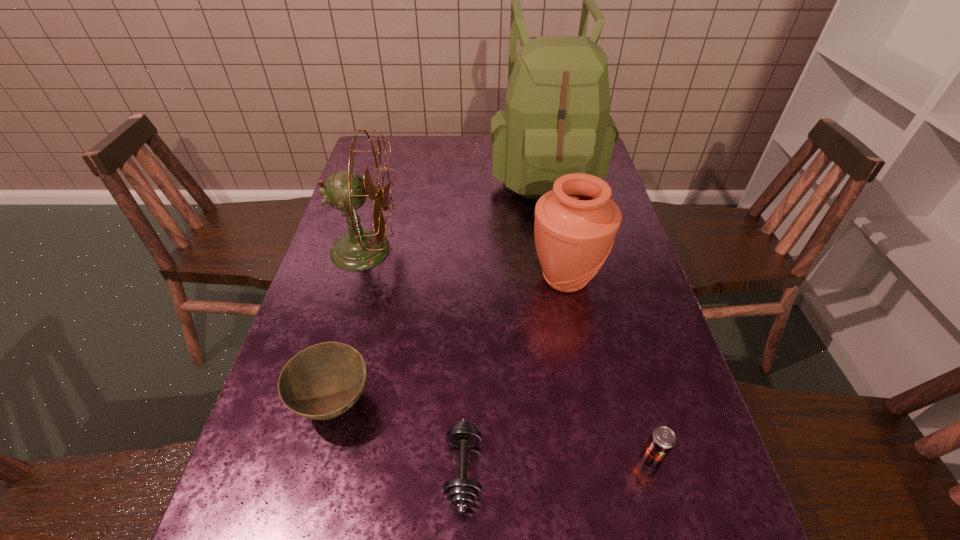
This screenshot has height=540, width=960. I want to click on backpack, so click(x=556, y=121).

The image size is (960, 540). Identify the location of the tallest object. (556, 121).

Where is `fan`? The width and height of the screenshot is (960, 540). fan is located at coordinates click(x=359, y=249).

You are a GUI agent. You are given a task and a screenshot of the screen. Output one action in this format:
    pyautogui.click(x=<x>, y=<y>)
    Task: Click on the vase
    
    Given the screenshot: What is the action you would take?
    pyautogui.click(x=575, y=225)

The image size is (960, 540). I want to click on bowl, so click(321, 382).

You are a GUI agent. You are given a task and a screenshot of the screen. Output one action in this format:
    pyautogui.click(x=<x>, y=<y>)
    Task: Click on the beer can
    This screenshot has width=960, height=540.
    Given the screenshot: What is the action you would take?
    pyautogui.click(x=662, y=440)

The image size is (960, 540). Find the location of `the shortest object`. the shortest object is located at coordinates (461, 493).

At what (x,y) coordinates should I click in order to perform the action: click on the fourth object from right to left. Please return your answer as a coordinate pair (x, y). This screenshot has height=540, width=960. Looking at the image, I should click on (461, 493).

You are a GUI agent. You are given a task and a screenshot of the screen. Output one action in this format:
    pyautogui.click(x=<x>, y=<y>)
    Task: Click on the free space located 0.400m on the front pocket of the farthest object
    
    Given the screenshot: What is the action you would take?
    pyautogui.click(x=570, y=311)

Identify the location of vacant area situated in front of the fan, directing air flow. The height and width of the screenshot is (540, 960). (441, 250).